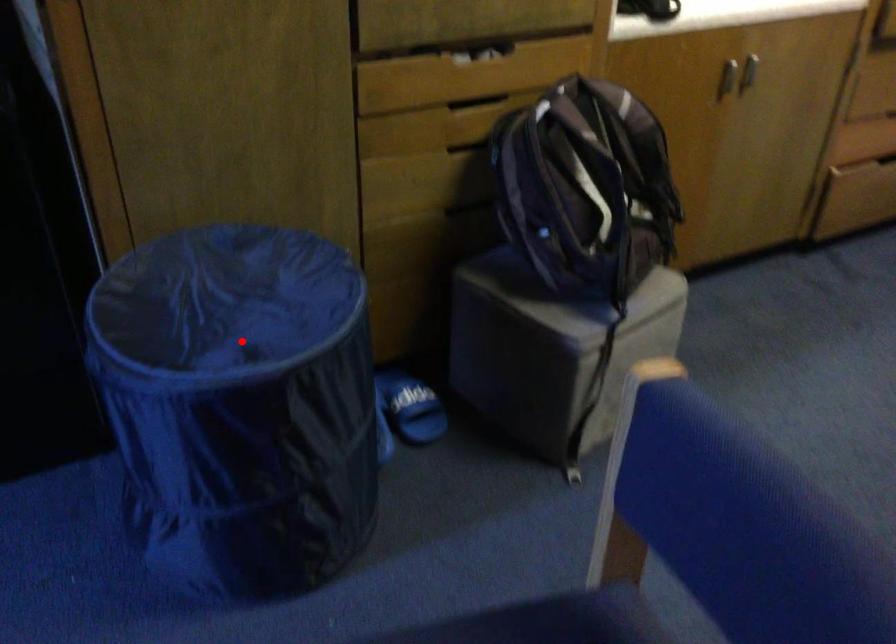
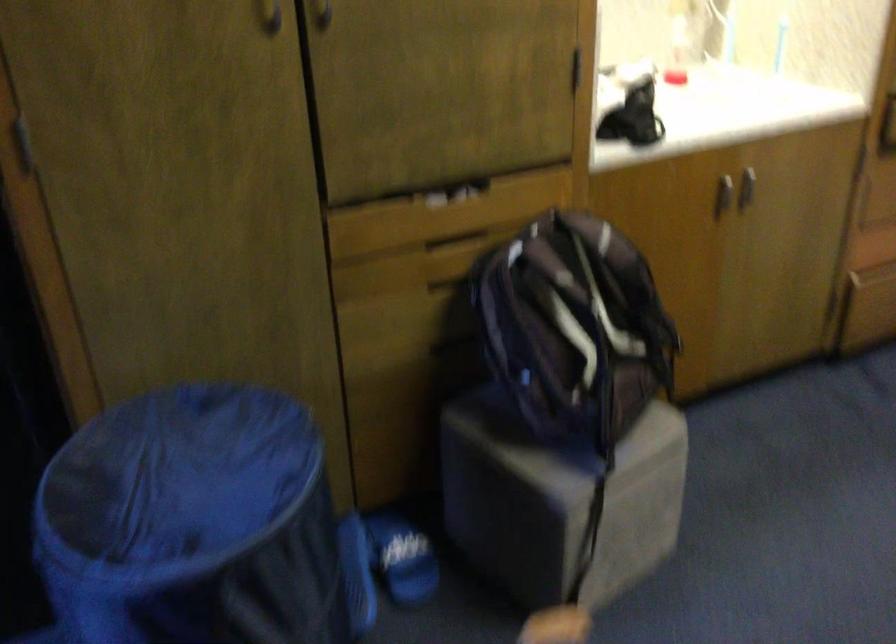
Where in the second image is the point corresponding to the highlighted location from the first image?

(193, 523)